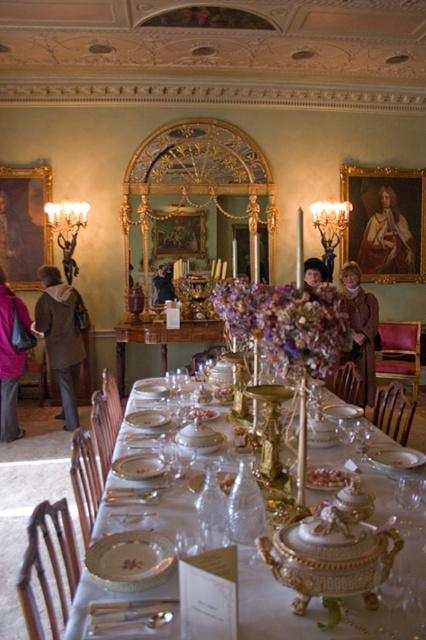
Question: From the image, what is the correct spatial relationship of wooden table at center in relation to matte gold frame at upper left?

Choices:
 (A) left
 (B) right

Answer: (B)

Question: Is pink fabric coat at left to the left of transparent glass wine glass at table center from the viewer's perspective?

Choices:
 (A) no
 (B) yes

Answer: (B)

Question: Which object is closer to the camera taking this photo?

Choices:
 (A) brown leather jacket at center
 (B) white porcelain table at center

Answer: (B)

Question: Which object is the closest to the brown wool coat at left?

Choices:
 (A) white porcelain table at center
 (B) matte gold frame at upper left
 (C) smooth red velvet portrait at upper right

Answer: (B)

Question: Does pink fabric coat at left have a greater width compared to brown leather jacket at center?

Choices:
 (A) yes
 (B) no

Answer: (B)

Question: Which object is farther from the camera taking this photo?

Choices:
 (A) pink fabric coat at left
 (B) brown wool coat at left
 (C) polished silver spoon at center

Answer: (B)